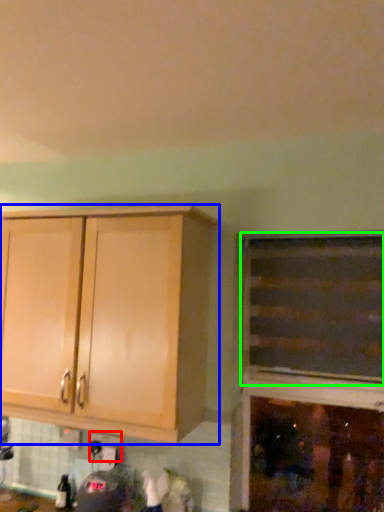
Question: Based on their relative distances, which object is nearer to electric outlet (highlighted by a red box)? Choose from cabinetry (highlighted by a blue box) and cabinetry (highlighted by a green box).

Choices:
 (A) cabinetry
 (B) cabinetry

Answer: (A)